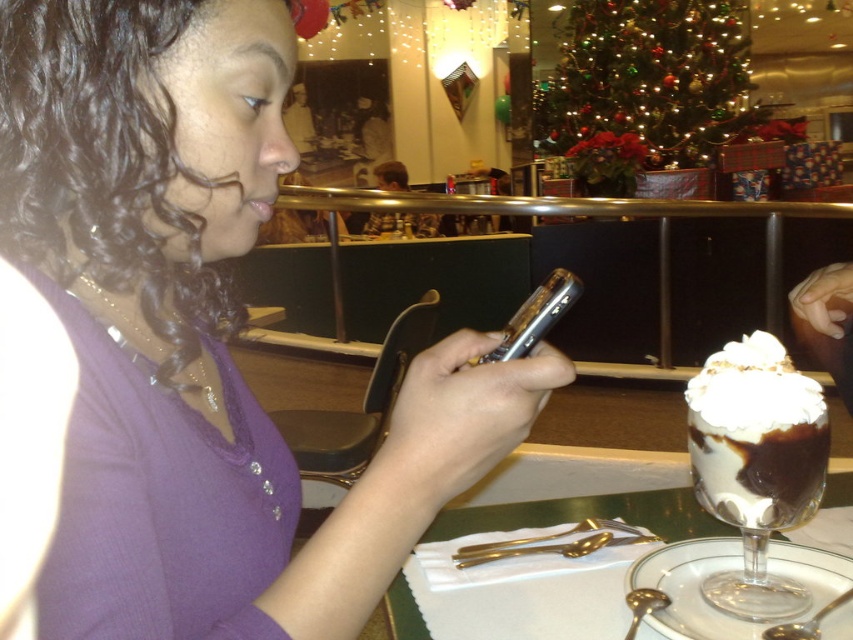
Question: Can you confirm if clear glass dessert at lower right is positioned to the right of silver metallic phone at center?

Choices:
 (A) yes
 (B) no

Answer: (A)

Question: From the image, what is the correct spatial relationship of purple matte shirt at center in relation to silver metallic phone at center?

Choices:
 (A) left
 (B) right

Answer: (A)

Question: Which point is closer to the camera?

Choices:
 (A) (389, 598)
 (B) (59, 221)

Answer: (B)

Question: Which object is the farthest from the silver metallic phone at center?

Choices:
 (A) clear glass dessert at lower right
 (B) purple matte shirt at center

Answer: (A)

Question: In this image, where is purple matte shirt at center located relative to silver metallic phone at center?

Choices:
 (A) below
 (B) above

Answer: (A)

Question: Which point appears farthest from the camera in this image?

Choices:
 (A) (543, 320)
 (B) (839, 484)
 (C) (175, 19)

Answer: (B)